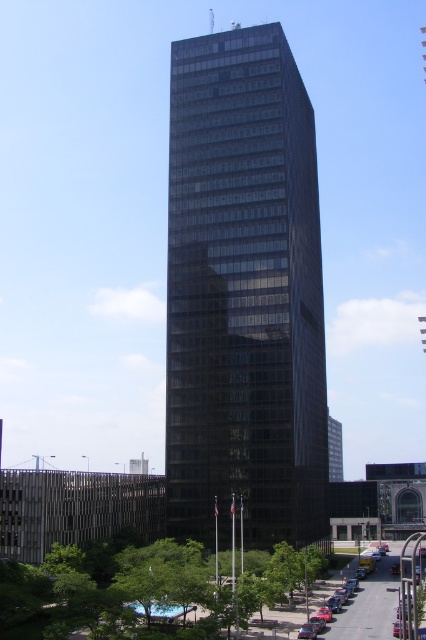
You are standing at the base of the skyscraper and want to take a photo of the two points mentioned in the scene. Which point is closer to you, point (x=216, y=378) or point (x=374, y=605)?

Point (x=374, y=605) is closer to you because it is in front of point (x=216, y=378).

You are a delivery driver approaching the dark glass skyscraper at center and the metallic silver sedan at lower right. Which object is closer to the left side of your view?

The dark glass skyscraper at center is positioned on the left side of the metallic silver sedan at lower right, so it is closer to the left side of your view.

You are driving a metallic silver sedan at lower right and want to park it near the dark glass skyscraper at center. Considering the height of the skyscraper, will the sedan be visible from the street level?

The dark glass skyscraper at center is much taller than the metallic silver sedan at lower right, so the sedan will be visible from the street level as it is shorter than the building.